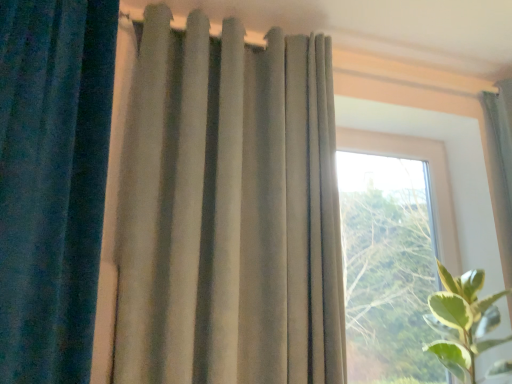
Question: Can you confirm if satin beige curtain at upper right, the 3th curtain in the left-to-right sequence, is taller than green leafy plant at right?

Choices:
 (A) yes
 (B) no

Answer: (A)

Question: Is green leafy plant at right completely or partially inside satin beige curtain at upper right, the 3th curtain in the left-to-right sequence?

Choices:
 (A) no
 (B) yes

Answer: (A)

Question: Is satin beige curtain at upper right, the 3th curtain in the left-to-right sequence, at the left side of green leafy plant at right?

Choices:
 (A) no
 (B) yes

Answer: (A)

Question: From a real-world perspective, is satin beige curtain at upper right, the 3th curtain in the left-to-right sequence, positioned over green leafy plant at right based on gravity?

Choices:
 (A) no
 (B) yes

Answer: (B)

Question: Are satin beige curtain at upper right, the 3th curtain in the left-to-right sequence, and green leafy plant at right beside each other?

Choices:
 (A) yes
 (B) no

Answer: (B)

Question: From a real-world perspective, is satin beige curtain at upper right, the 3th curtain in the left-to-right sequence, positioned above or below velvet blue curtain at left, which appears as the third curtain when viewed from the right?

Choices:
 (A) above
 (B) below

Answer: (A)

Question: Looking at the image, does satin beige curtain at upper right, the 3th curtain in the left-to-right sequence, seem bigger or smaller compared to velvet blue curtain at left, arranged as the first curtain when viewed from the left?

Choices:
 (A) big
 (B) small

Answer: (B)

Question: From their relative heights in the image, would you say satin beige curtain at upper right, placed as the first curtain when sorted from right to left, is taller or shorter than velvet blue curtain at left, which appears as the third curtain when viewed from the right?

Choices:
 (A) short
 (B) tall

Answer: (A)

Question: Is satin beige curtain at upper right, the 3th curtain in the left-to-right sequence, in front of or behind velvet blue curtain at left, which appears as the third curtain when viewed from the right, in the image?

Choices:
 (A) behind
 (B) front

Answer: (A)

Question: From the image's perspective, relative to satin beige curtain at upper right, the 3th curtain in the left-to-right sequence, is suede-like beige curtain at center, acting as the second curtain starting from the left, above or below?

Choices:
 (A) above
 (B) below

Answer: (A)

Question: Considering the positions of suede-like beige curtain at center, acting as the second curtain starting from the left, and satin beige curtain at upper right, placed as the first curtain when sorted from right to left, in the image, is suede-like beige curtain at center, acting as the second curtain starting from the left, taller or shorter than satin beige curtain at upper right, placed as the first curtain when sorted from right to left,?

Choices:
 (A) short
 (B) tall

Answer: (B)

Question: Relative to satin beige curtain at upper right, placed as the first curtain when sorted from right to left, is suede-like beige curtain at center, acting as the second curtain starting from the left, in front or behind?

Choices:
 (A) front
 (B) behind

Answer: (A)

Question: Is suede-like beige curtain at center, acting as the second curtain starting from the left, bigger or smaller than satin beige curtain at upper right, the 3th curtain in the left-to-right sequence?

Choices:
 (A) big
 (B) small

Answer: (A)

Question: From a real-world perspective, is satin beige curtain at upper right, placed as the first curtain when sorted from right to left, physically located above or below green leafy plant at right?

Choices:
 (A) below
 (B) above

Answer: (B)

Question: Considering the positions of satin beige curtain at upper right, placed as the first curtain when sorted from right to left, and green leafy plant at right in the image, is satin beige curtain at upper right, placed as the first curtain when sorted from right to left, bigger or smaller than green leafy plant at right?

Choices:
 (A) small
 (B) big

Answer: (A)